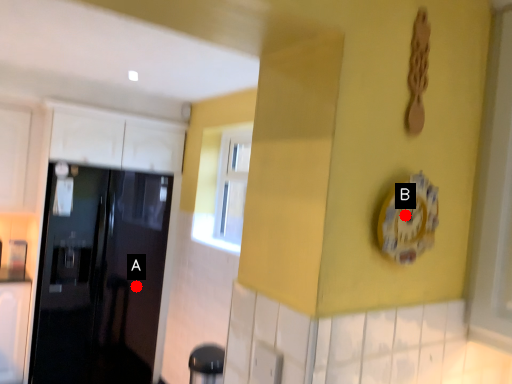
Question: Two points are circled on the image, labeled by A and B beside each circle. Which of the following is the closest to the observer?

Choices:
 (A) A is closer
 (B) B is closer

Answer: (B)